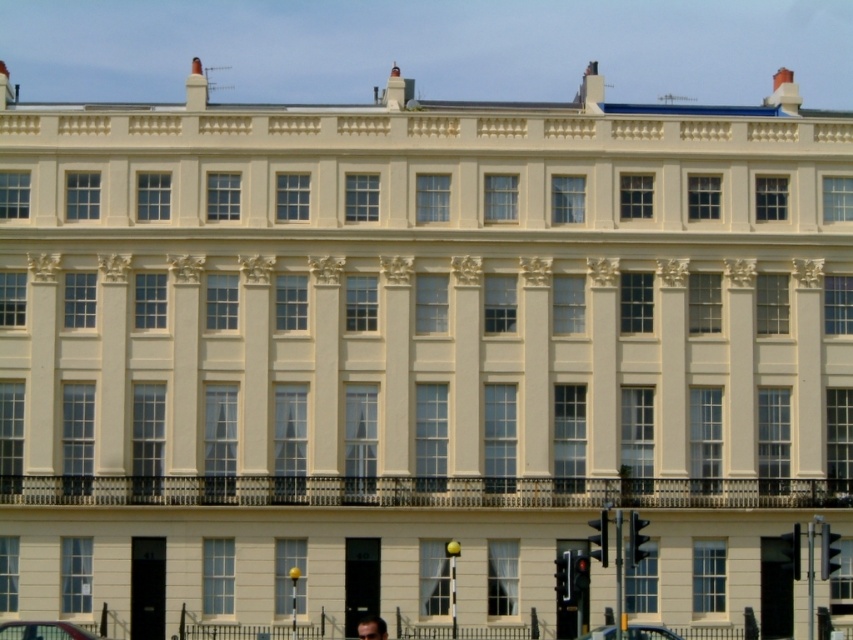
You are standing in front of the building and see the metallic silver car at center and the dark brown hair at lower center. Which object is closer to you?

The metallic silver car at center is closer to you than the dark brown hair at lower center because it is further to the viewer.